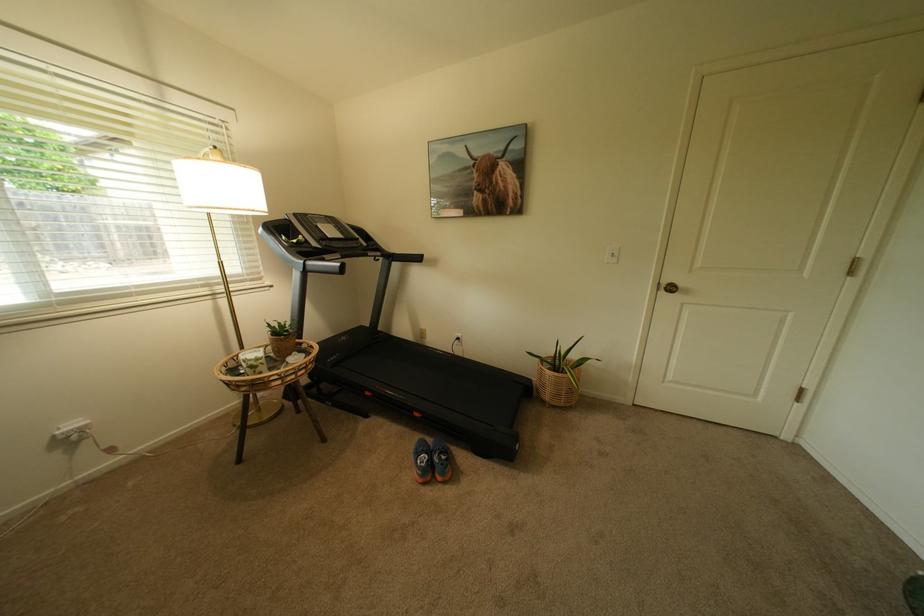
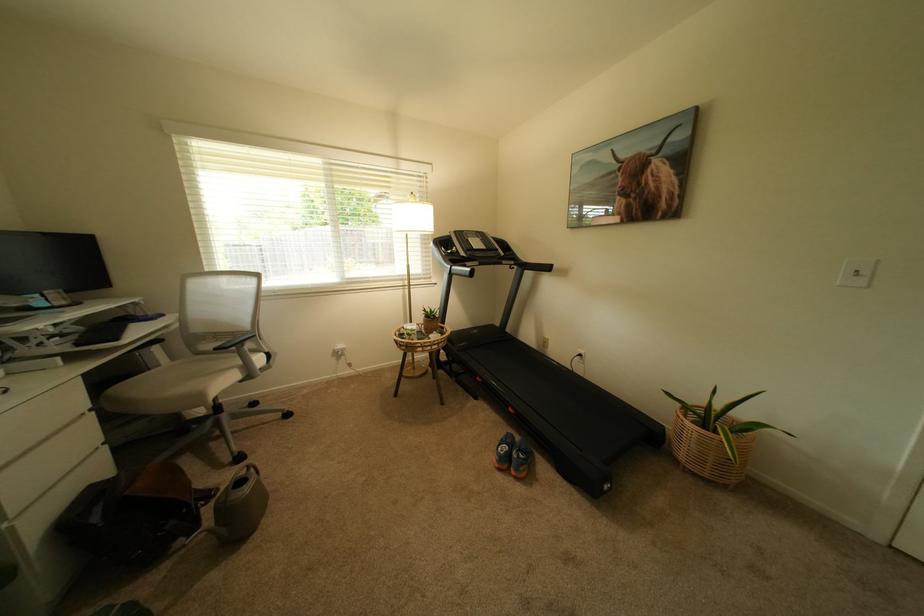
Locate, in the second image, the point that corresponds to pixel 557 391 in the first image.

(695, 448)